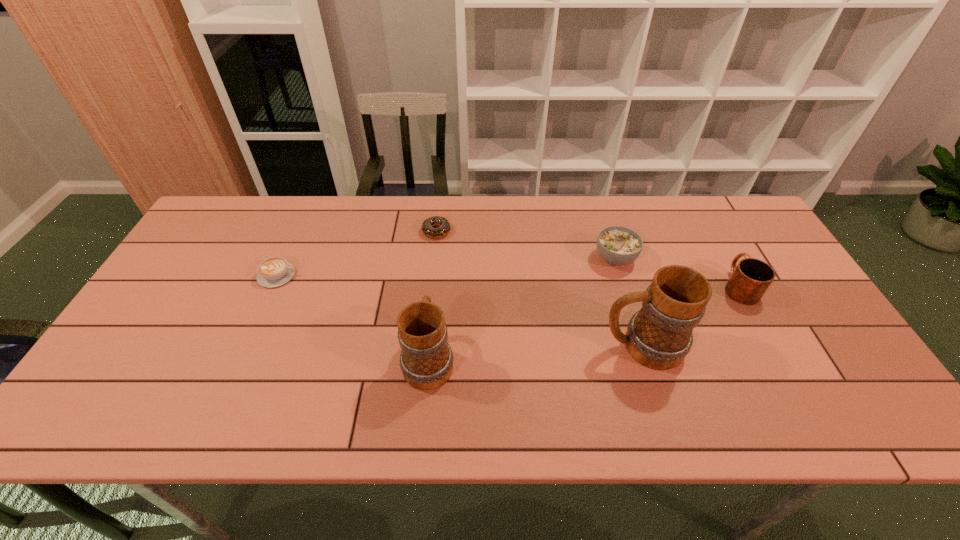
Find the location of a particular element. The image size is (960, 540). vacant region at the far left corner of the desktop is located at coordinates (252, 209).

Find the location of a particular element. The height and width of the screenshot is (540, 960). vacant space at the near left corner of the desktop is located at coordinates (108, 379).

Find the location of a particular element. The width and height of the screenshot is (960, 540). vacant area at the far right corner of the desktop is located at coordinates (740, 233).

Image resolution: width=960 pixels, height=540 pixels. Find the location of `vacant area that lies between the second shortest object and the tallest mug`. vacant area that lies between the second shortest object and the tallest mug is located at coordinates (460, 310).

Identify the location of vacant area that lies between the second shortest mug and the cappuccino. This screenshot has height=540, width=960. click(x=353, y=318).

Locate an element on the screen. The image size is (960, 540). vacant point located between the second tallest mug and the rightmost mug is located at coordinates (584, 323).

The image size is (960, 540). Identify the location of empty space that is in between the leftmost mug and the third tallest object. (584, 323).

Identify the location of vacant area that lies between the leftmost mug and the fourth tallest object. (522, 308).

Identify the location of free spot between the doughnut and the leftmost mug. coord(433,295).

The image size is (960, 540). I want to click on empty space between the tallest mug and the cappuccino, so click(460, 310).